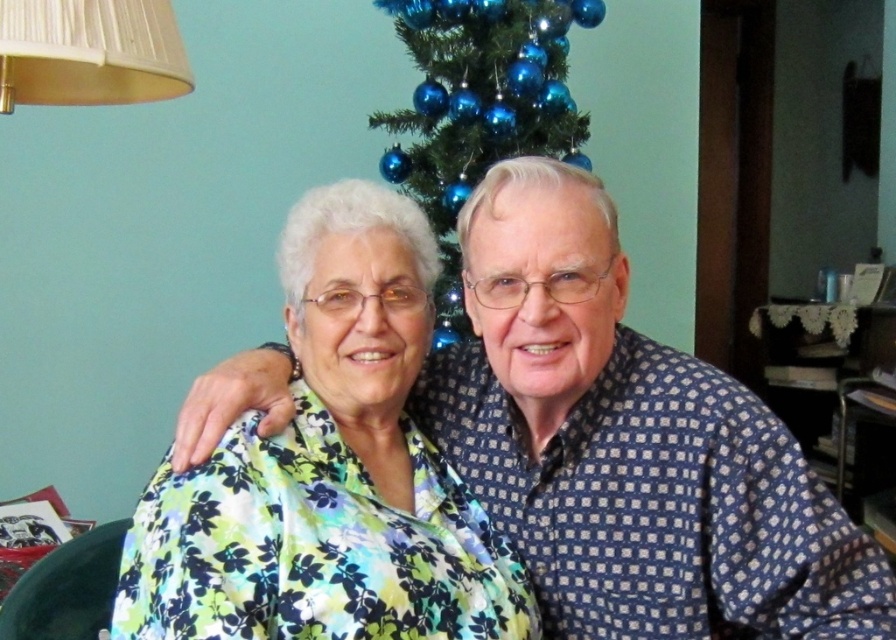
You are a photographer adjusting the camera focus. You need to ensure both the blue glass ornaments at center and the white pleated lampshade at upper left are in focus. Which object should you focus on first to capture both in the same frame?

You should focus on the white pleated lampshade at upper left first because the blue glass ornaments at center is above it, so adjusting focus from the lower object upwards will help capture both in the same frame.

You are a photographer setting up for a portrait. You need to ensure there is at least 6 inches of space between the two subjects wearing the blue dotted shirt at center and the floral fabric blouse at center. Based on the scene, is the current distance sufficient?

The distance between the blue dotted shirt at center and the floral fabric blouse at center is 5.24 inches, which is less than the required 6 inches. Therefore, the current spacing is insufficient.

You are trying to locate the blue dotted shirt at center in the image. According to the coordinates provided, where exactly is it positioned?

The blue dotted shirt at center is located at point coordinates of (629, 448).